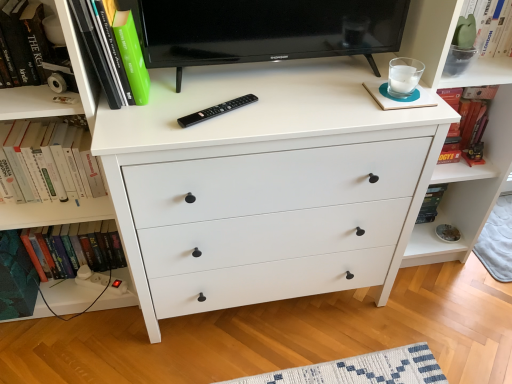
Find the location of a particular element. This screenshot has height=384, width=512. free spot in front of green matte book at upper left, the first book from the top is located at coordinates (135, 131).